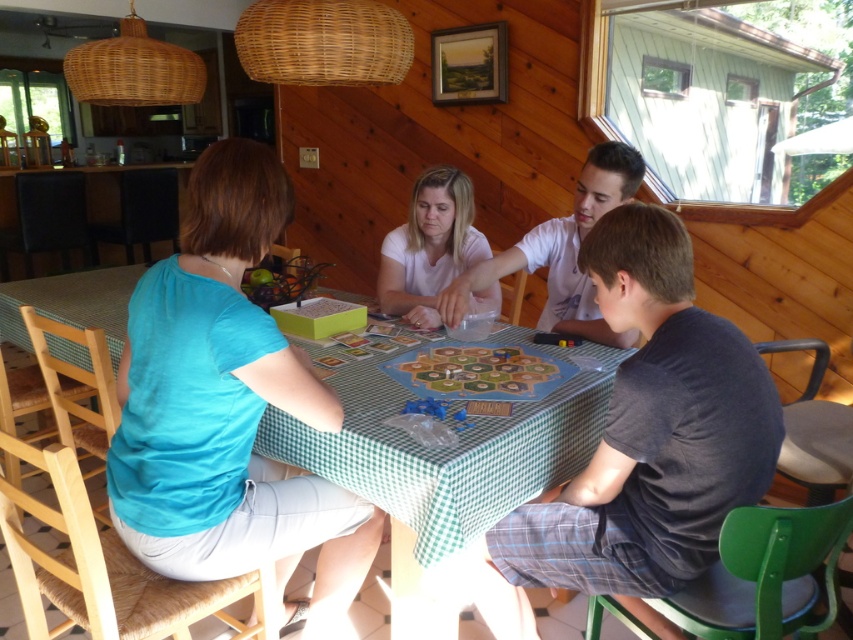
Question: Does teal fabric shirt at left appear over dark gray cotton shirt at center?

Choices:
 (A) yes
 (B) no

Answer: (B)

Question: Which of the following is the closest to the observer?

Choices:
 (A) smooth white shirt at center
 (B) white matte shirt at center
 (C) dark gray cotton shirt at center
 (D) teal fabric shirt at left

Answer: (C)

Question: Can you confirm if smooth white shirt at center is positioned below white matte shirt at center?

Choices:
 (A) yes
 (B) no

Answer: (A)

Question: Among these objects, which one is farthest from the camera?

Choices:
 (A) green checkered table at center
 (B) dark gray cotton shirt at center

Answer: (A)

Question: Where is dark gray cotton shirt at center located in relation to smooth white shirt at center in the image?

Choices:
 (A) above
 (B) below

Answer: (B)

Question: Which point is farther from the camera taking this photo?

Choices:
 (A) (439, 278)
 (B) (412, 444)
 (C) (219, 413)
 (D) (593, 220)

Answer: (A)